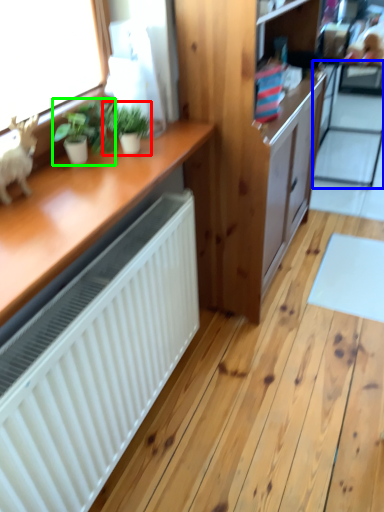
Question: Which object is positioned farthest from houseplant (highlighted by a red box)? Select from screen door (highlighted by a blue box) and houseplant (highlighted by a green box).

Choices:
 (A) screen door
 (B) houseplant

Answer: (A)